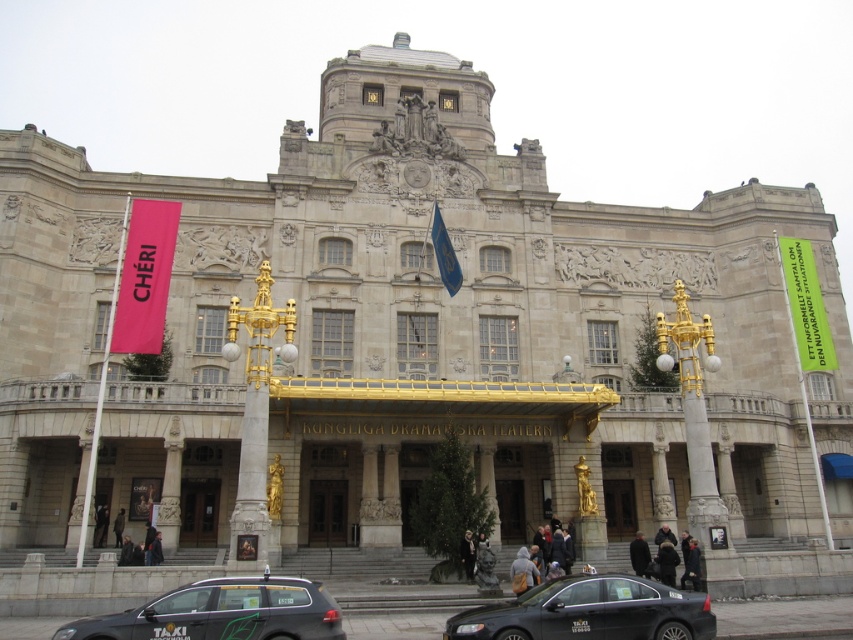
Between black glossy taxi cab at lower center and green fabric banner at right, which one appears on the right side from the viewer's perspective?

Positioned to the right is green fabric banner at right.

Can you confirm if black glossy taxi cab at lower center is smaller than green fabric banner at right?

No, black glossy taxi cab at lower center is not smaller than green fabric banner at right.

Find the location of a particular element. This screenshot has width=853, height=640. black glossy taxi cab at lower center is located at coordinates (590, 612).

Can you confirm if green fabric banner at right is bigger than blue fabric flag at center?

Indeed, green fabric banner at right has a larger size compared to blue fabric flag at center.

Can you confirm if green fabric banner at right is taller than blue fabric flag at center?

Yes, green fabric banner at right is taller than blue fabric flag at center.

Does point (790, 305) lie in front of point (440, 250)?

No, it is behind (440, 250).

You are a GUI agent. You are given a task and a screenshot of the screen. Output one action in this format:
    pyautogui.click(x=<x>, y=<y>)
    Task: Click on the green fabric banner at right
    This screenshot has height=640, width=853.
    Given the screenshot: What is the action you would take?
    pyautogui.click(x=805, y=305)

Does black glossy taxi cab at lower center appear on the right side of brown wooden door at center?

Indeed, black glossy taxi cab at lower center is positioned on the right side of brown wooden door at center.

Does black glossy taxi cab at lower center appear under brown wooden door at center?

No, black glossy taxi cab at lower center is not below brown wooden door at center.

What do you see at coordinates (590, 612) in the screenshot? This screenshot has height=640, width=853. I see `black glossy taxi cab at lower center` at bounding box center [590, 612].

Locate an element on the screen. black glossy taxi cab at lower center is located at coordinates (590, 612).